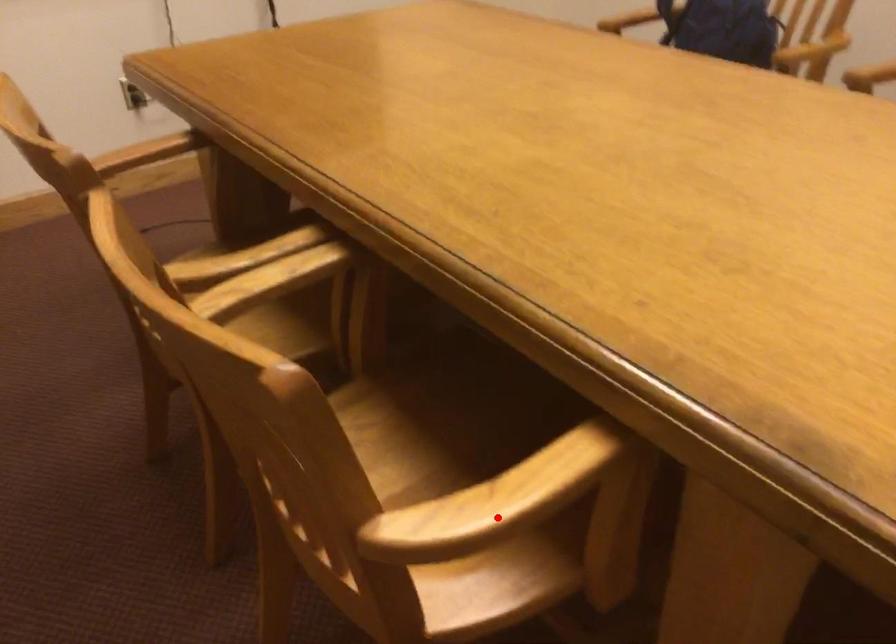
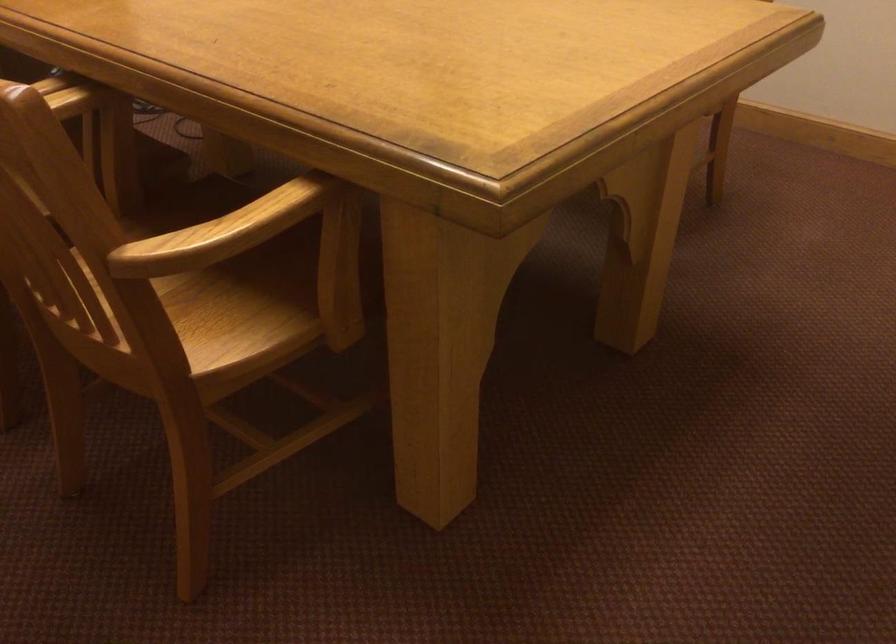
Question: I am providing you with two images of the same scene from different viewpoints. A red point is shown in image1. For the corresponding object point in image2, is it positioned nearer or farther from the camera?

Choices:
 (A) Nearer
 (B) Farther

Answer: (B)